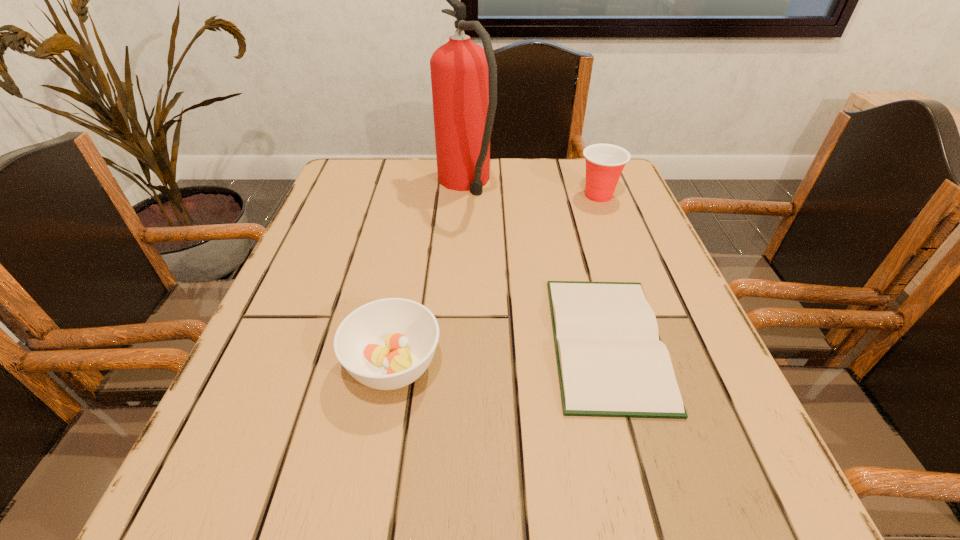
The height and width of the screenshot is (540, 960). In order to click on cup at the right edge in this screenshot , I will do (604, 162).

Find the location of a particular element. The height and width of the screenshot is (540, 960). hardback book situated at the right edge is located at coordinates (611, 361).

Find the location of `object situated at the far right corner`. object situated at the far right corner is located at coordinates (604, 162).

Find the location of a particular element. The height and width of the screenshot is (540, 960). vacant space at the far edge is located at coordinates (537, 164).

Where is `blank area at the near edge`? blank area at the near edge is located at coordinates (646, 504).

At what (x,y) coordinates should I click in order to perform the action: click on free region at the left edge. Please return your answer as a coordinate pair (x, y). Looking at the image, I should click on point(343,256).

This screenshot has width=960, height=540. Identify the location of free space at the right edge of the desktop. (704, 409).

The width and height of the screenshot is (960, 540). Identify the location of free region at the far left corner. (400, 163).

This screenshot has width=960, height=540. What are the coordinates of `vacant region at the near left corner of the desktop` in the screenshot? It's located at (311, 474).

Find the location of a particular element. The width and height of the screenshot is (960, 540). empty space between the third shortest object and the second shortest object is located at coordinates (496, 280).